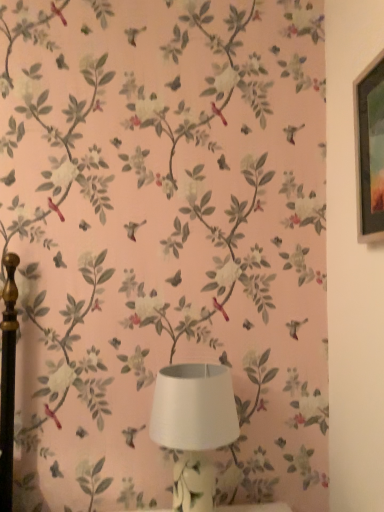
Question: Should I look upward or downward to see white matte lampshade at center?

Choices:
 (A) down
 (B) up

Answer: (A)

Question: Considering the relative sizes of white matte lampshade at center and metallic silver picture frame at upper right in the image provided, is white matte lampshade at center taller than metallic silver picture frame at upper right?

Choices:
 (A) no
 (B) yes

Answer: (A)

Question: Considering the relative sizes of white matte lampshade at center and metallic silver picture frame at upper right in the image provided, is white matte lampshade at center bigger than metallic silver picture frame at upper right?

Choices:
 (A) yes
 (B) no

Answer: (A)

Question: Is white matte lampshade at center facing towards metallic silver picture frame at upper right?

Choices:
 (A) no
 (B) yes

Answer: (A)

Question: From a real-world perspective, is white matte lampshade at center below metallic silver picture frame at upper right?

Choices:
 (A) no
 (B) yes

Answer: (B)

Question: Is white matte lampshade at center looking in the opposite direction of metallic silver picture frame at upper right?

Choices:
 (A) no
 (B) yes

Answer: (A)

Question: Is metallic silver picture frame at upper right located within white matte lampshade at center?

Choices:
 (A) no
 (B) yes

Answer: (A)

Question: Is metallic silver picture frame at upper right oriented away from white matte lampshade at center?

Choices:
 (A) yes
 (B) no

Answer: (B)

Question: Can you confirm if metallic silver picture frame at upper right is wider than white matte lampshade at center?

Choices:
 (A) no
 (B) yes

Answer: (A)

Question: From a real-world perspective, is metallic silver picture frame at upper right positioned under white matte lampshade at center based on gravity?

Choices:
 (A) no
 (B) yes

Answer: (A)

Question: Can you confirm if metallic silver picture frame at upper right is smaller than white matte lampshade at center?

Choices:
 (A) no
 (B) yes

Answer: (B)

Question: Is metallic silver picture frame at upper right oriented towards white matte lampshade at center?

Choices:
 (A) no
 (B) yes

Answer: (A)

Question: Would you consider metallic silver picture frame at upper right to be distant from white matte lampshade at center?

Choices:
 (A) no
 (B) yes

Answer: (A)

Question: In terms of size, does metallic silver picture frame at upper right appear bigger or smaller than white matte lampshade at center?

Choices:
 (A) small
 (B) big

Answer: (A)